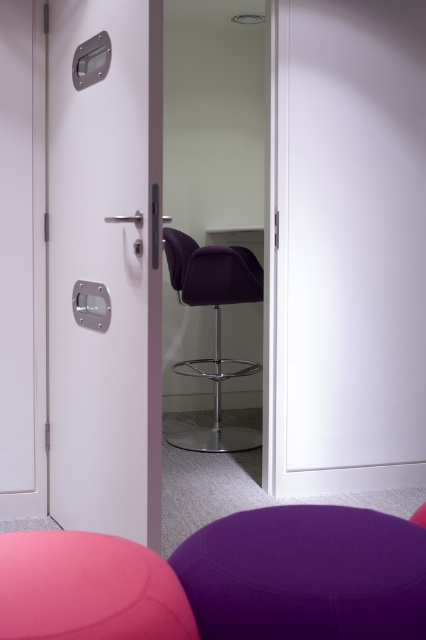
You are standing in the waiting area and need to locate the purple fabric bar stool at lower center. Based on the scene, which direction should you move relative to the purple fabric bar stool at center?

The purple fabric bar stool at lower center is located to the right of the purple fabric bar stool at center. Therefore, you should move to the right relative to the purple fabric bar stool at center to find it.

You are standing in the waiting area and want to move from the pink ottoman to the purple ottoman. The coordinates of the pink ottoman are point (423, 513) and the purple ottoman are point (244, 272). Which ottoman is closer to you?

Point (423, 513) is closer to the viewer than point (244, 272), so the pink ottoman is closer to you.

You are designing a seating arrangement for a cozy reading nook. You have a purple fabric bar stool at lower center and a purple velvet swivel chair at center. Which of these two items would be better suited for someone who prefers a lower seating height?

The purple fabric bar stool at lower center has a lesser height compared to the purple velvet swivel chair at center, so it would be better suited for someone who prefers a lower seating height.